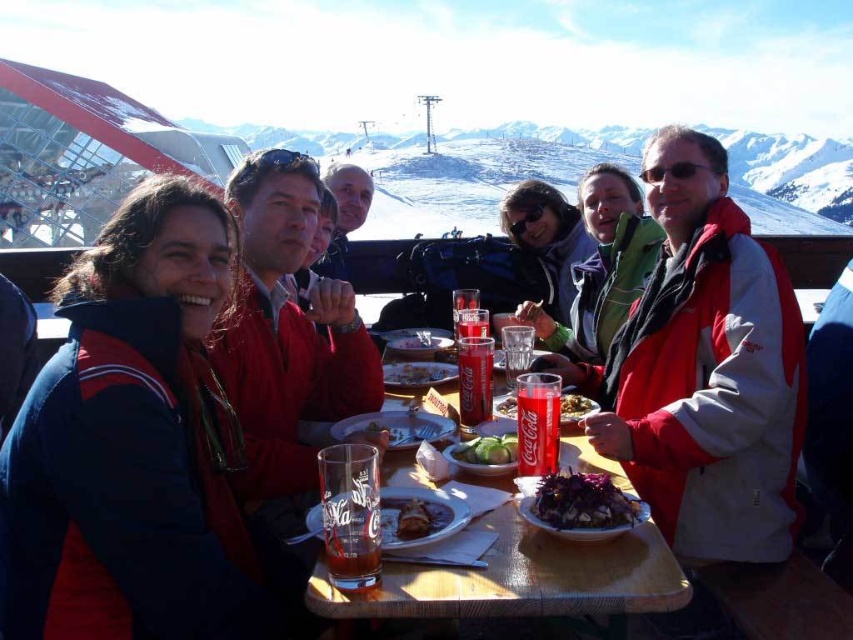
Based on the photo, can you confirm if purple matte salad at center is positioned to the right of coca-cola glass at center?

Indeed, purple matte salad at center is positioned on the right side of coca-cola glass at center.

Is purple matte salad at center bigger than coca-cola glass at center?

Correct, purple matte salad at center is larger in size than coca-cola glass at center.

Does point (532, 513) lie in front of point (469, 422)?

Yes, point (532, 513) is in front of point (469, 422).

Find the location of a particular element. The height and width of the screenshot is (640, 853). purple matte salad at center is located at coordinates (583, 502).

Where is `matte black jacket at center`? Image resolution: width=853 pixels, height=640 pixels. matte black jacket at center is located at coordinates (547, 240).

Between matte black jacket at center and smooth yellow cheese at center, which one appears on the left side from the viewer's perspective?

Positioned to the left is smooth yellow cheese at center.

In order to click on matte black jacket at center in this screenshot , I will do `click(547, 240)`.

Locate an element on the screen. Image resolution: width=853 pixels, height=640 pixels. matte black jacket at center is located at coordinates (547, 240).

Is purple matte salad at center to the left of shiny brown meat at center from the viewer's perspective?

In fact, purple matte salad at center is to the right of shiny brown meat at center.

Between purple matte salad at center and shiny brown meat at center, which one is positioned lower?

Positioned lower is shiny brown meat at center.

Image resolution: width=853 pixels, height=640 pixels. Describe the element at coordinates (583, 502) in the screenshot. I see `purple matte salad at center` at that location.

Find the location of a particular element. purple matte salad at center is located at coordinates (583, 502).